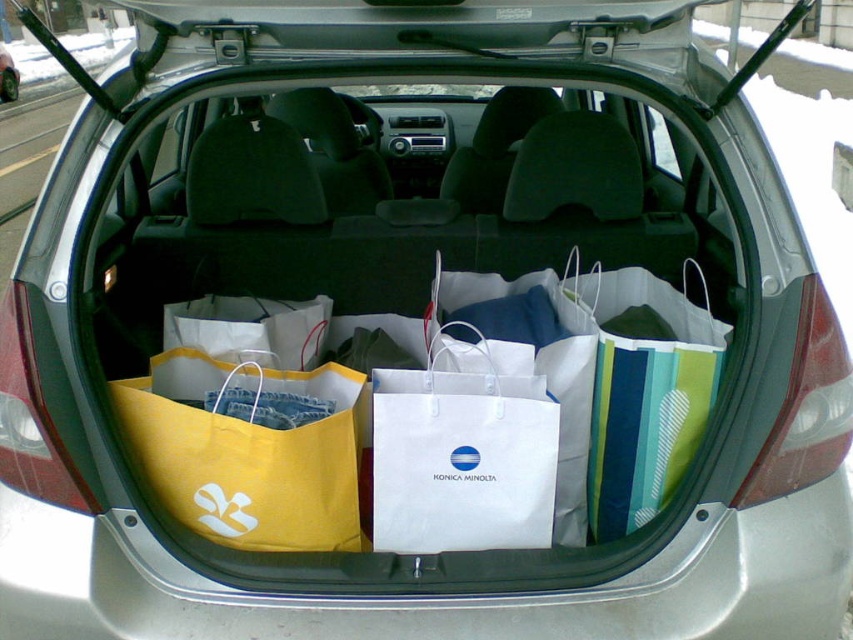
Can you confirm if yellow paper bag at center is positioned to the right of white paper bag at center?

No, yellow paper bag at center is not to the right of white paper bag at center.

Which is behind, point (212, 428) or point (543, 392)?

The point (543, 392) is behind.

Does point (138, 451) come in front of point (422, 397)?

No, (138, 451) is behind (422, 397).

The height and width of the screenshot is (640, 853). What are the coordinates of `yellow paper bag at center` in the screenshot? It's located at (247, 454).